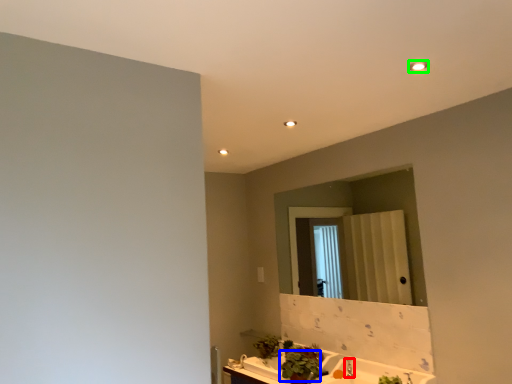
Question: Which is farther away from faucet (highlighted by a red box)? plant (highlighted by a blue box) or light fixture (highlighted by a green box)?

Choices:
 (A) plant
 (B) light fixture

Answer: (B)